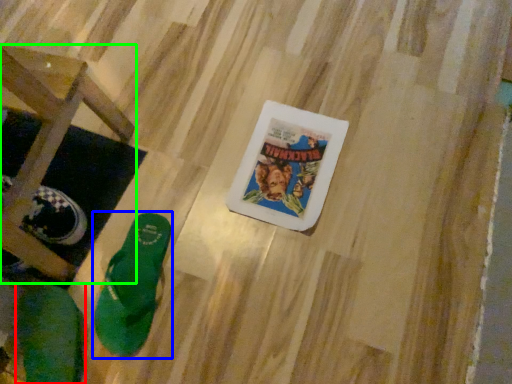
Question: Estimate the real-world distances between objects in this image. Which object is farther from footwear (highlighted by a red box), footwear (highlighted by a blue box) or furniture (highlighted by a green box)?

Choices:
 (A) footwear
 (B) furniture

Answer: (B)